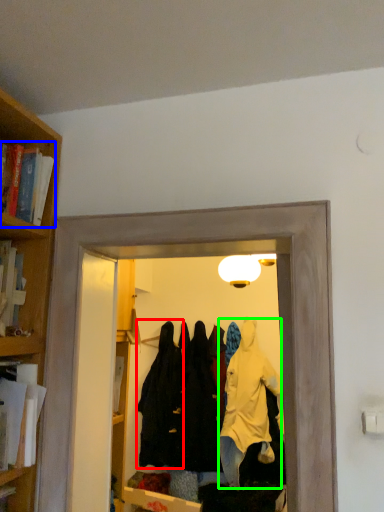
Question: Which is nearer to the clothing (highlighted by a red box)? book (highlighted by a blue box) or clothing (highlighted by a green box).

Choices:
 (A) book
 (B) clothing

Answer: (B)